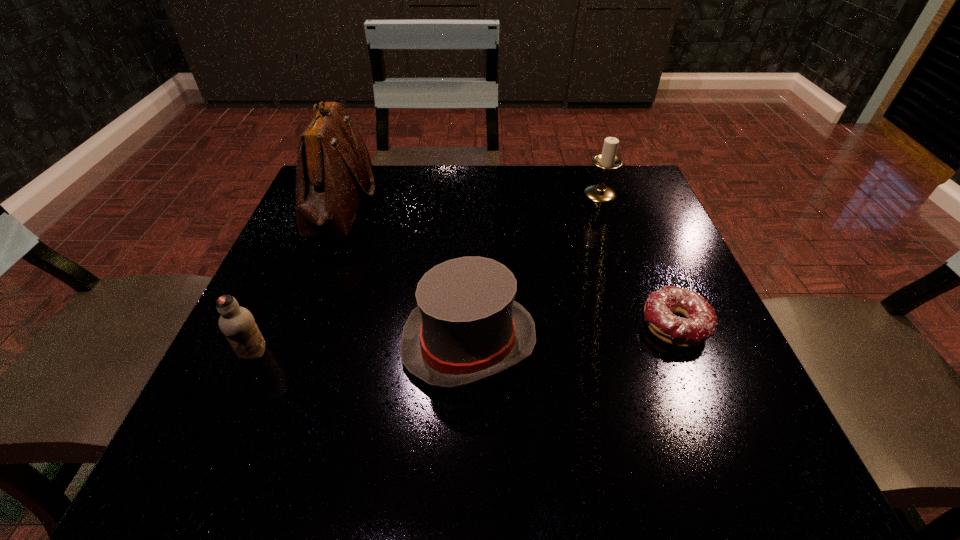
Identify the location of the tallest object. (334, 168).

The width and height of the screenshot is (960, 540). In order to click on candle holder in this screenshot , I will do `click(607, 160)`.

Where is `the third object from right to left`? the third object from right to left is located at coordinates (467, 327).

Locate an element on the screen. The image size is (960, 540). chocolate milk is located at coordinates (237, 323).

You are a GUI agent. You are given a task and a screenshot of the screen. Output one action in this format:
    pyautogui.click(x=<x>, y=<y>)
    Task: Click on the doughnut
    
    Given the screenshot: What is the action you would take?
    pyautogui.click(x=700, y=323)

At what (x,y) coordinates should I click in order to perform the action: click on free space located on the front of the tallest object. Please return your answer as a coordinate pair (x, y). Image resolution: width=960 pixels, height=540 pixels. Looking at the image, I should click on (293, 325).

I want to click on free spot located on the left of the candle holder, so click(x=446, y=194).

Where is `free space located 0.220m on the right of the third object from right to left`? The height and width of the screenshot is (540, 960). free space located 0.220m on the right of the third object from right to left is located at coordinates (663, 342).

Find the location of a particular element. free space located on the right of the chocolate milk is located at coordinates (459, 353).

Identify the location of vacant space positioned on the back of the shortest object. This screenshot has width=960, height=540. (635, 229).